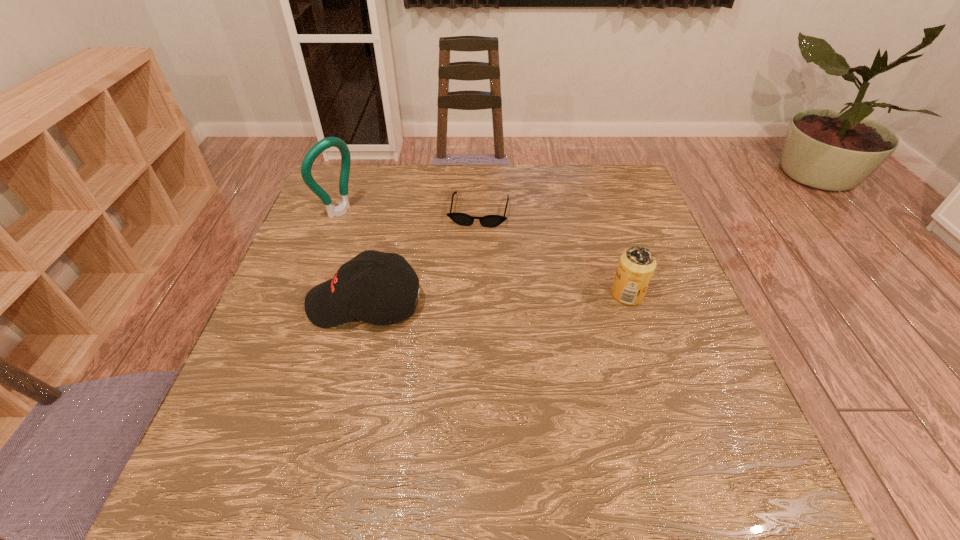
Identify the location of free space on the desktop that is between the baseball cap and the beer can and is positioned at the jaws of the tallest object. The image size is (960, 540). (488, 299).

Where is `free space on the desktop that is between the baseball cap and the beer can and is positioned on the front-facing side of the sunglasses`? free space on the desktop that is between the baseball cap and the beer can and is positioned on the front-facing side of the sunglasses is located at coordinates (463, 300).